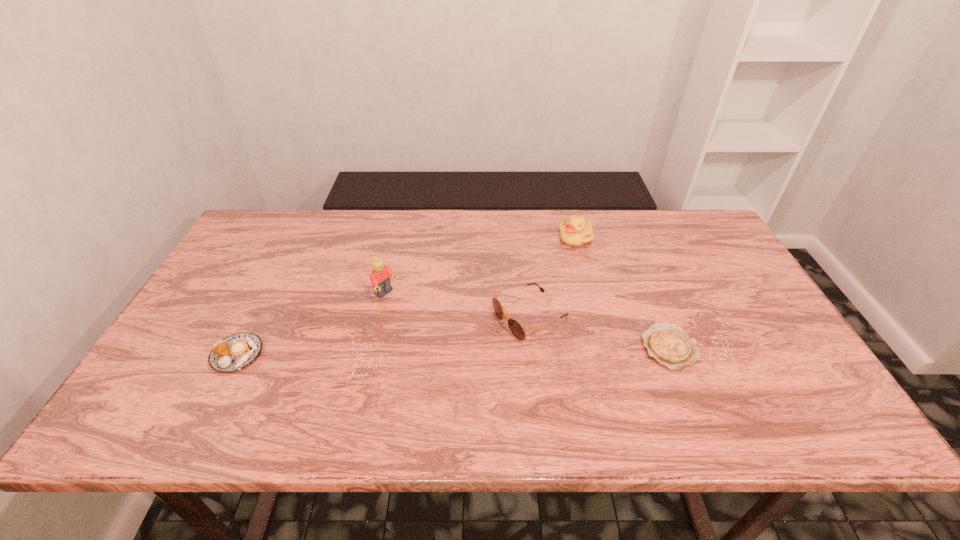
This screenshot has height=540, width=960. Find the location of `free space on the desktop that is between the pastry and the rightmost object and is positioned on the lenses of the sunglasses`. free space on the desktop that is between the pastry and the rightmost object and is positioned on the lenses of the sunglasses is located at coordinates (459, 351).

Where is `vacant space on the desktop that is between the pastry and the shortest object and is positioned at the face of the second tallest object`? vacant space on the desktop that is between the pastry and the shortest object and is positioned at the face of the second tallest object is located at coordinates (502, 350).

This screenshot has height=540, width=960. I want to click on vacant space on the desktop that is between the pastry and the shortest object and is positioned on the face of the tallest object, so click(x=469, y=350).